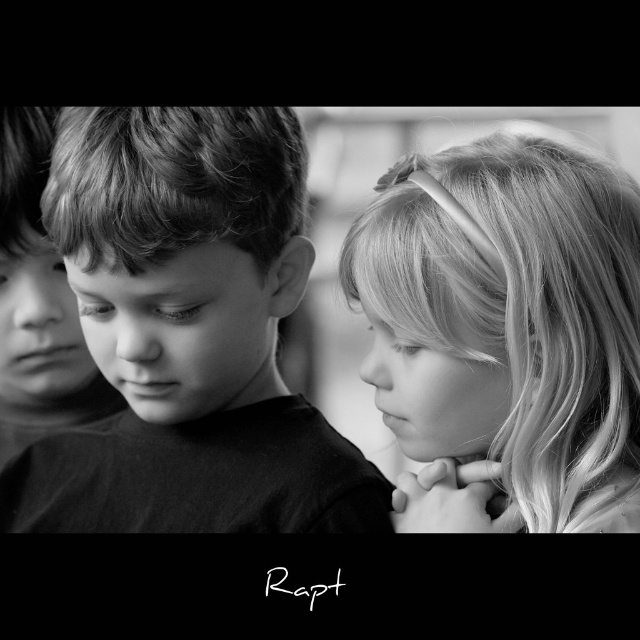
Which is above, smooth blonde hair at upper right or black matte boy at left?

black matte boy at left

Is the position of smooth blonde hair at upper right less distant than that of black matte boy at left?

Yes, it is in front of black matte boy at left.

What do you see at coordinates (506, 332) in the screenshot? I see `smooth blonde hair at upper right` at bounding box center [506, 332].

You are a GUI agent. You are given a task and a screenshot of the screen. Output one action in this format:
    pyautogui.click(x=<x>, y=<y>)
    Task: Click on the smooth blonde hair at upper right
    The height and width of the screenshot is (640, 640).
    Given the screenshot: What is the action you would take?
    pyautogui.click(x=506, y=332)

Looking at this image, can you confirm if black matte shirt at center is bigger than black matte boy at left?

Yes, black matte shirt at center is bigger than black matte boy at left.

Is point (360, 528) behind point (44, 246)?

No, (360, 528) is closer to viewer.

Find the location of a particular element. black matte shirt at center is located at coordinates (188, 333).

Does black matte shirt at center have a lesser width compared to smooth blonde hair at upper right?

Incorrect, black matte shirt at center's width is not less than smooth blonde hair at upper right's.

In the scene shown: Who is more forward, (x=378, y=483) or (x=627, y=225)?

Point (x=627, y=225)

At what (x,y) coordinates should I click in order to perform the action: click on black matte shirt at center. Please return your answer as a coordinate pair (x, y). The image size is (640, 640). Looking at the image, I should click on pyautogui.click(x=188, y=333).